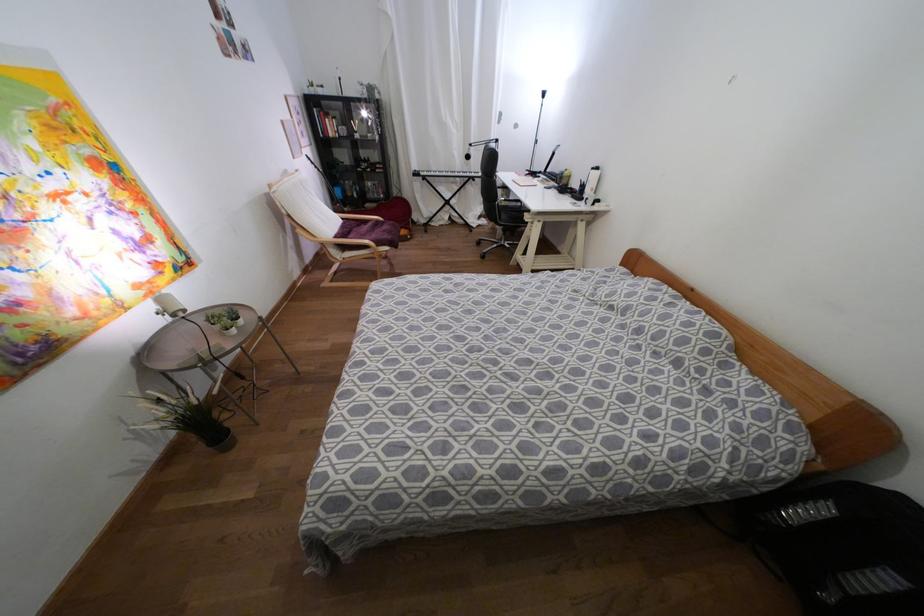
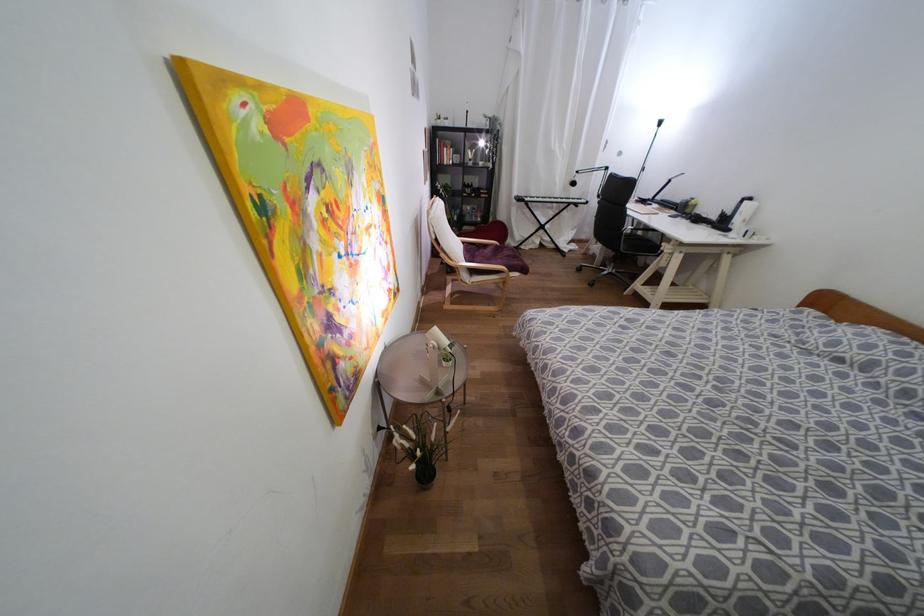
In the second image, find the point that corresponds to (596,168) in the first image.

(749, 198)